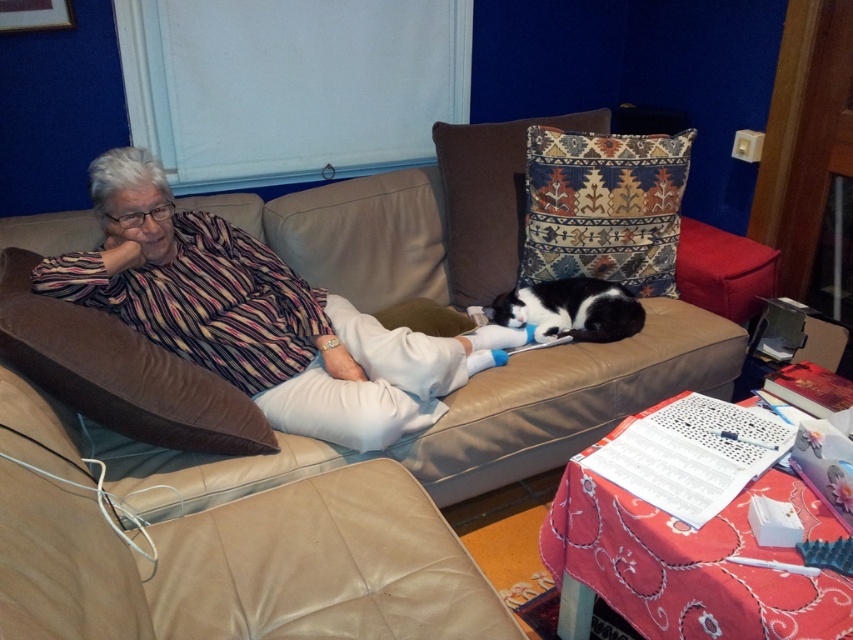
Question: Which point appears farthest from the camera in this image?

Choices:
 (A) (51, 308)
 (B) (303, 376)

Answer: (B)

Question: Where is striped fabric shirt at center located in relation to brown velvety pillow at left in the image?

Choices:
 (A) below
 (B) above

Answer: (B)

Question: Can you confirm if textured woolen pillow at upper center is bigger than black fur cat at center?

Choices:
 (A) no
 (B) yes

Answer: (B)

Question: Which object appears closest to the camera in this image?

Choices:
 (A) brown velvety pillow at left
 (B) black fur cat at center

Answer: (A)

Question: Based on their relative distances, which object is farther from the patterned fabric pillow at center?

Choices:
 (A) brown velvety pillow at left
 (B) black fur cat at center
 (C) leather couch at center
 (D) textured woolen pillow at upper center

Answer: (A)

Question: Is brown velvety pillow at left wider than textured woolen pillow at upper center?

Choices:
 (A) no
 (B) yes

Answer: (B)